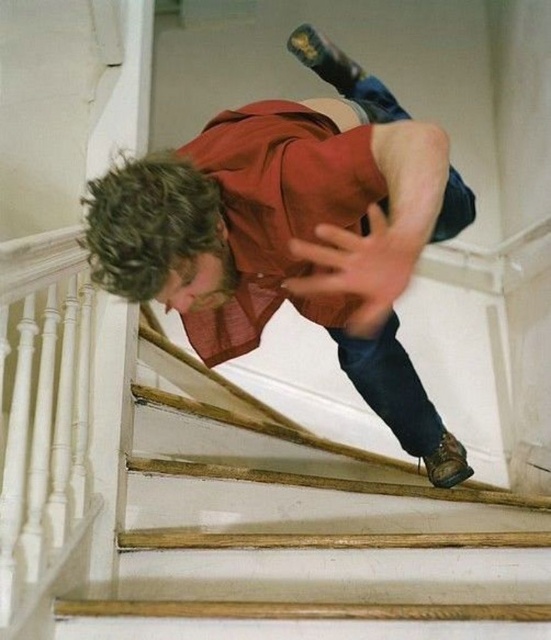
Question: Which point is farther to the camera?

Choices:
 (A) (331, 81)
 (B) (511, 616)

Answer: (A)

Question: Is wooden stairs at center below matte red shirt at center?

Choices:
 (A) yes
 (B) no

Answer: (A)

Question: Which point is farther to the camera?

Choices:
 (A) (301, 269)
 (B) (217, 458)

Answer: (B)

Question: Does wooden stairs at center have a larger size compared to matte red shirt at center?

Choices:
 (A) yes
 (B) no

Answer: (B)

Question: Does wooden stairs at center appear under matte red shirt at center?

Choices:
 (A) yes
 (B) no

Answer: (A)